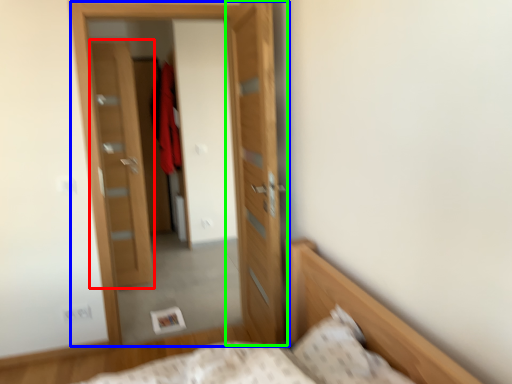
Question: Which is nearer to the door (highlighted by a red box)? door (highlighted by a blue box) or door (highlighted by a green box).

Choices:
 (A) door
 (B) door

Answer: (A)